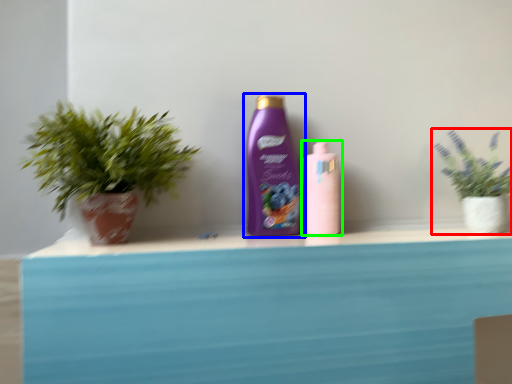
Question: Which object is the closest to the houseplant (highlighted by a red box)? Choose among these: bottle (highlighted by a blue box) or bottle (highlighted by a green box).

Choices:
 (A) bottle
 (B) bottle

Answer: (B)